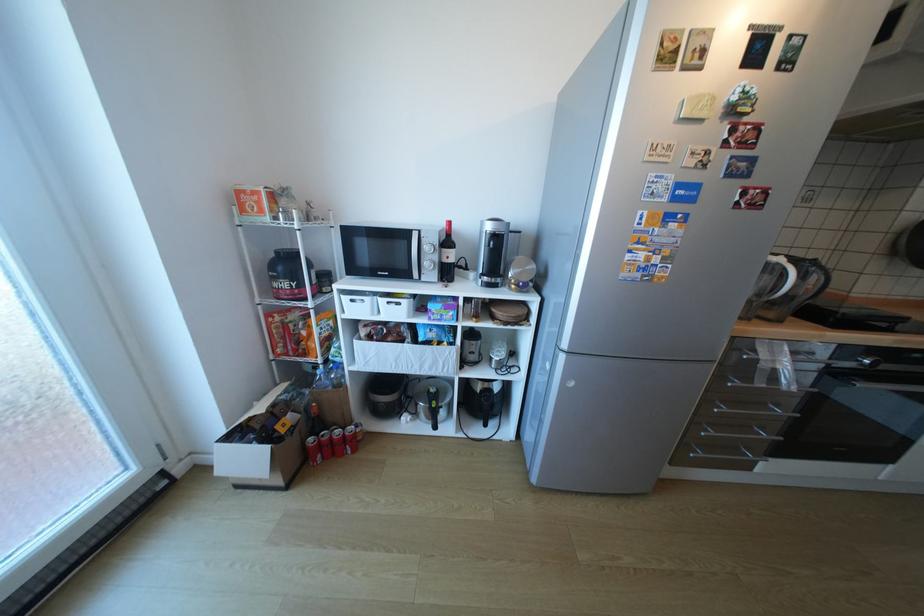
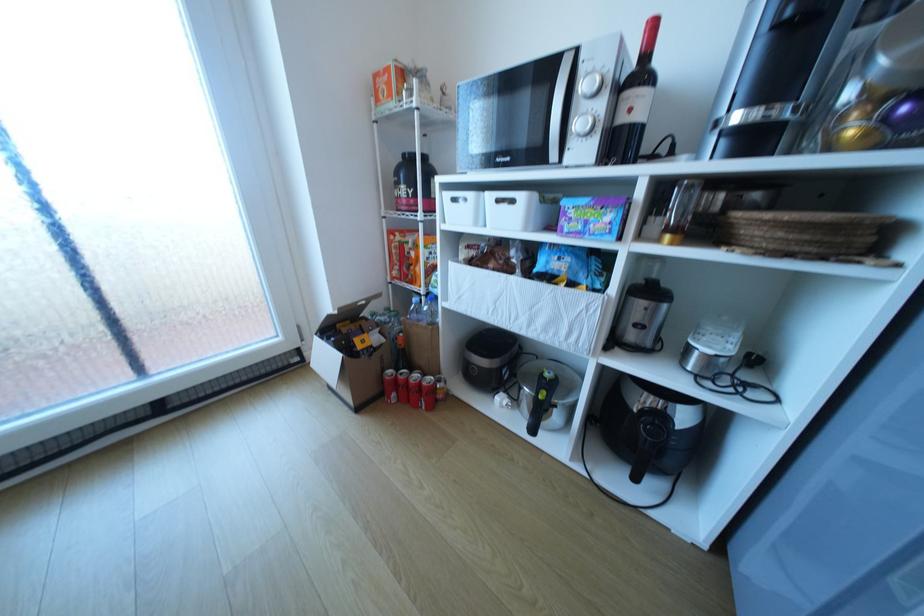
Question: The first image is from the beginning of the video and the second image is from the end. How did the camera likely rotate when shooting the video?

Choices:
 (A) Left
 (B) Right
 (C) Up
 (D) Down

Answer: (A)